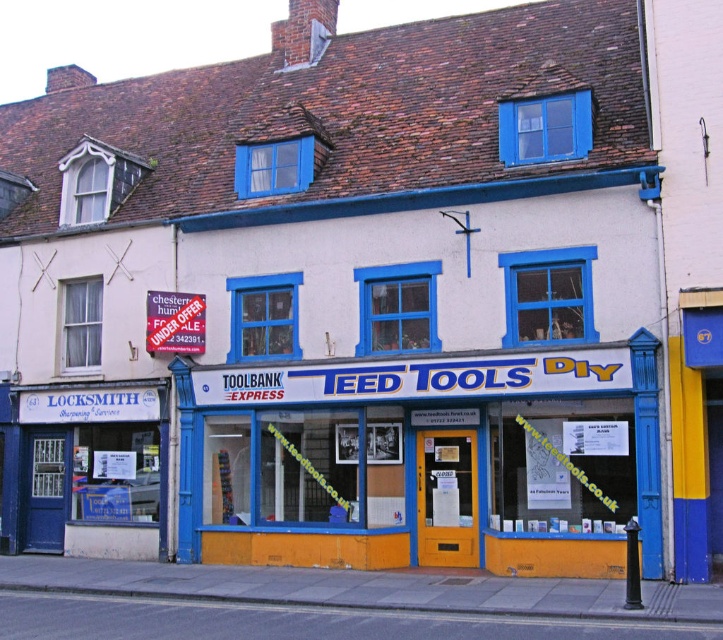
Which of these two, yellow matte door at center or white plastic sign at upper left, stands shorter?

With less height is white plastic sign at upper left.

How much distance is there between yellow matte door at center and white plastic sign at upper left?

A distance of 8.93 feet exists between yellow matte door at center and white plastic sign at upper left.

Who is more forward, [422,513] or [155,326]?

Point [422,513] is more forward.

Locate an element on the screen. The width and height of the screenshot is (723, 640). yellow matte door at center is located at coordinates (432, 460).